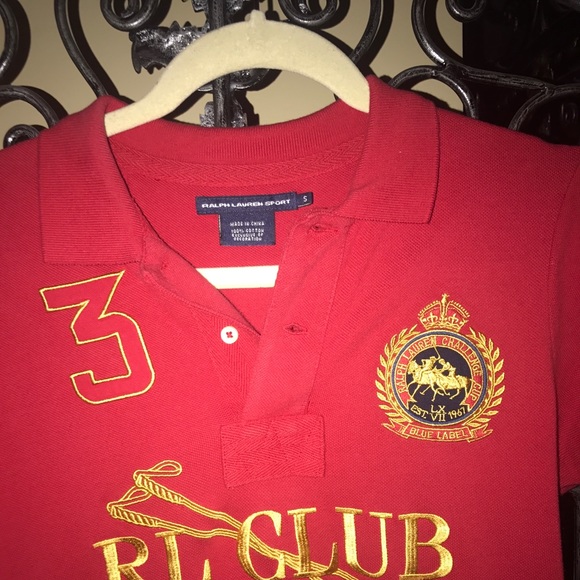
This screenshot has height=580, width=580. Find the location of `beige wall background`. beige wall background is located at coordinates (x=401, y=48), (x=30, y=67), (x=116, y=37), (x=285, y=101), (x=358, y=29), (x=455, y=23).